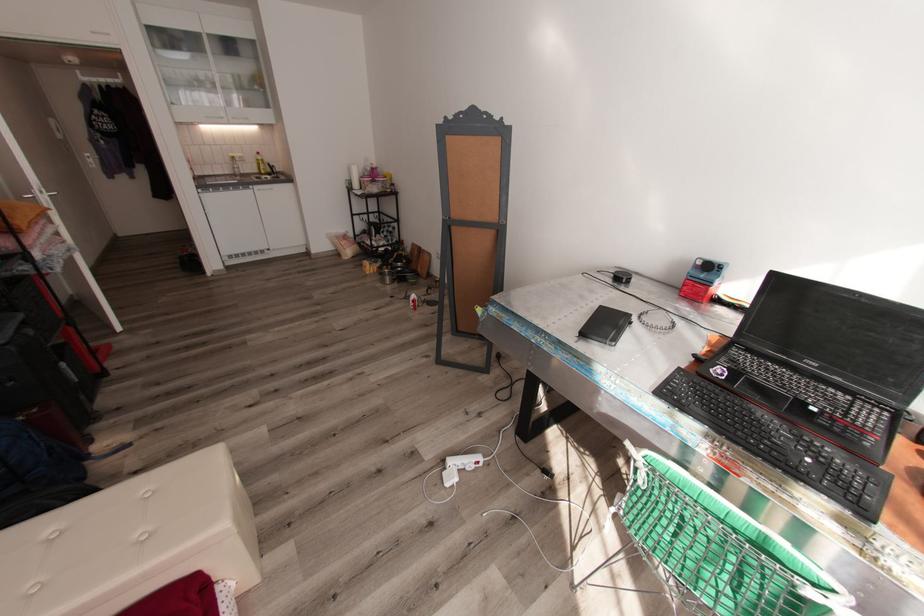
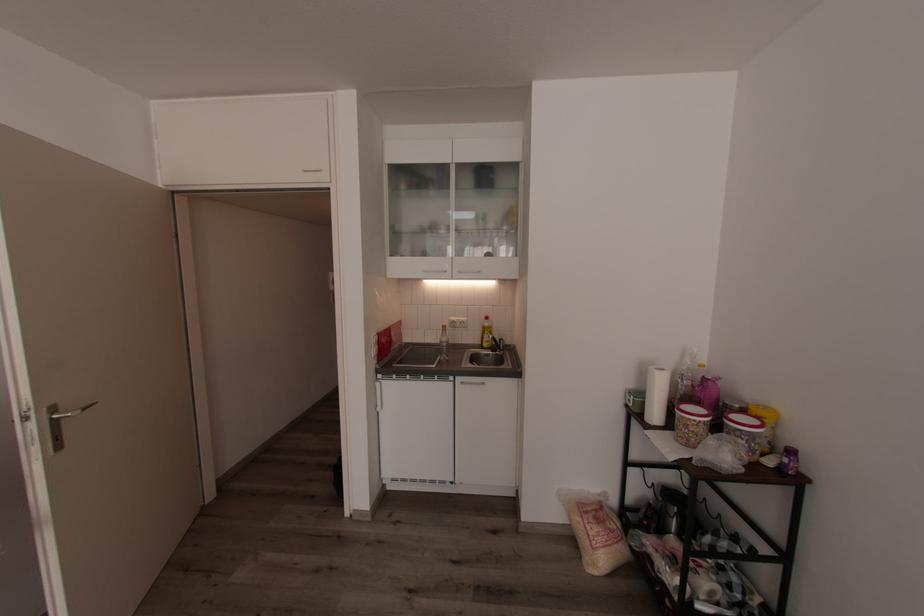
Find the pixel in the second image that matches (360,185) in the first image.

(660, 415)